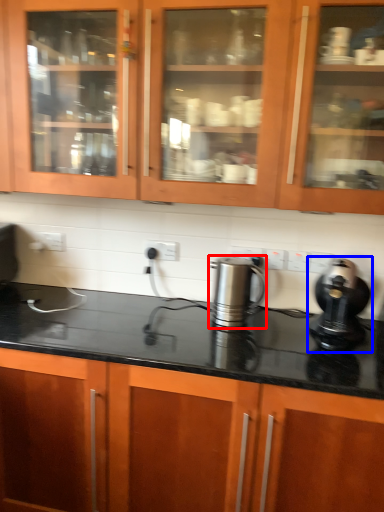
Question: Which object is further to the camera taking this photo, kitchen appliance (highlighted by a red box) or home appliance (highlighted by a blue box)?

Choices:
 (A) kitchen appliance
 (B) home appliance

Answer: (A)